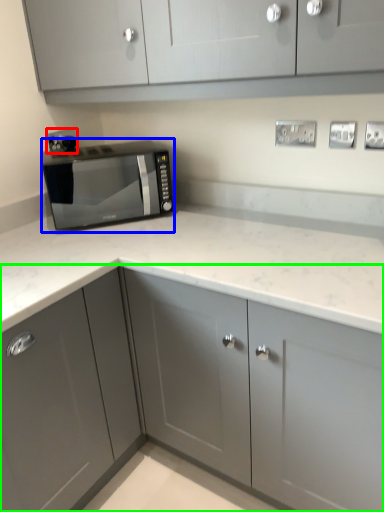
Question: Based on their relative distances, which object is nearer to electric outlet (highlighted by a red box)? Choose from microwave oven (highlighted by a blue box) and cabinetry (highlighted by a green box).

Choices:
 (A) microwave oven
 (B) cabinetry

Answer: (A)